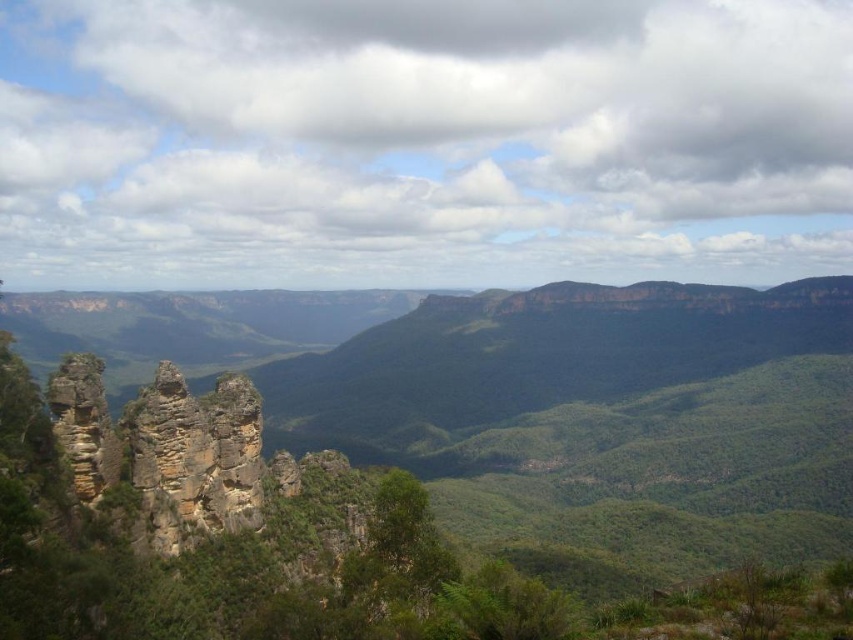
Does white fluffy cloud at upper center have a lesser width compared to rugged stone rock formation at left?

Incorrect, white fluffy cloud at upper center's width is not less than rugged stone rock formation at left's.

From the picture: Is white fluffy cloud at upper center smaller than rugged stone rock formation at left?

Incorrect, white fluffy cloud at upper center is not smaller in size than rugged stone rock formation at left.

Between point (590, 108) and point (236, 493), which one is positioned behind?

Positioned behind is point (590, 108).

Identify the location of white fluffy cloud at upper center. This screenshot has width=853, height=640. (422, 141).

Does rugged rock formation at center appear over rugged stone rock formation at left?

Incorrect, rugged rock formation at center is not positioned above rugged stone rock formation at left.

Measure the distance between point [368,356] and camera.

Point [368,356] is 1112.28 feet away from camera.

Between point (657, 396) and point (190, 513), which one is positioned in front?

Point (190, 513) is in front.

Locate an element on the screen. The image size is (853, 640). rugged rock formation at center is located at coordinates (434, 461).

Does white fluffy cloud at upper center appear on the left side of rugged rock formation at center?

Yes, white fluffy cloud at upper center is to the left of rugged rock formation at center.

Can you confirm if white fluffy cloud at upper center is shorter than rugged rock formation at center?

No.

Between point (554, 157) and point (219, 592), which one is positioned in front?

Point (219, 592) is more forward.

Find the location of a particular element. The image size is (853, 640). white fluffy cloud at upper center is located at coordinates (422, 141).